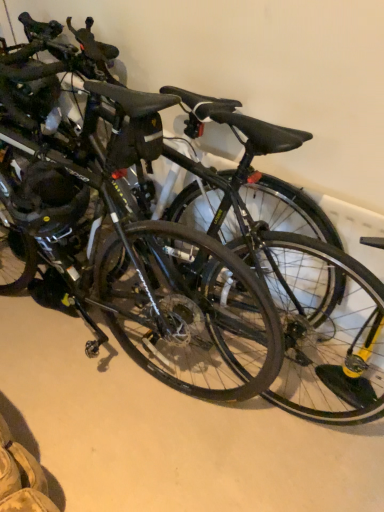
Question: Can you confirm if glossy black bicycle at center is taller than black matte bicycle at center?

Choices:
 (A) yes
 (B) no

Answer: (A)

Question: Does glossy black bicycle at center appear on the left side of black matte bicycle at center?

Choices:
 (A) yes
 (B) no

Answer: (B)

Question: Is glossy black bicycle at center further to camera compared to black matte bicycle at center?

Choices:
 (A) no
 (B) yes

Answer: (A)

Question: Is glossy black bicycle at center bigger than black matte bicycle at center?

Choices:
 (A) yes
 (B) no

Answer: (A)

Question: Considering the relative sizes of glossy black bicycle at center and black matte bicycle at center in the image provided, is glossy black bicycle at center shorter than black matte bicycle at center?

Choices:
 (A) yes
 (B) no

Answer: (B)

Question: Considering the positions of black matte bicycle at center and matte black helmet at left, which ranks as the first bicycle wheel in left-to-right order, in the image, is black matte bicycle at center taller or shorter than matte black helmet at left, which ranks as the first bicycle wheel in left-to-right order,?

Choices:
 (A) tall
 (B) short

Answer: (B)

Question: In the image, is black matte bicycle at center on the left side or the right side of matte black helmet at left, which ranks as the first bicycle wheel in left-to-right order?

Choices:
 (A) left
 (B) right

Answer: (B)

Question: Considering the positions of point (244, 465) and point (56, 185), is point (244, 465) closer or farther from the camera than point (56, 185)?

Choices:
 (A) farther
 (B) closer

Answer: (A)

Question: From the image's perspective, is black matte bicycle at center positioned above or below matte black helmet at left, which ranks as the first bicycle wheel in left-to-right order?

Choices:
 (A) below
 (B) above

Answer: (A)

Question: From a real-world perspective, is matte black helmet at left, acting as the second bicycle wheel starting from the right, positioned above or below glossy black bicycle at center?

Choices:
 (A) below
 (B) above

Answer: (B)

Question: From the image's perspective, relative to glossy black bicycle at center, is matte black helmet at left, which ranks as the first bicycle wheel in left-to-right order, above or below?

Choices:
 (A) above
 (B) below

Answer: (B)

Question: In the image, is matte black helmet at left, acting as the second bicycle wheel starting from the right, positioned in front of or behind glossy black bicycle at center?

Choices:
 (A) front
 (B) behind

Answer: (B)

Question: Is point (64, 168) closer or farther from the camera than point (134, 195)?

Choices:
 (A) farther
 (B) closer

Answer: (B)

Question: Looking at their shapes, would you say glossy black bicycle at center is wider or thinner than matte black helmet at left, which ranks as the first bicycle wheel in left-to-right order?

Choices:
 (A) wide
 (B) thin

Answer: (A)

Question: Considering the positions of glossy black bicycle at center and matte black helmet at left, acting as the second bicycle wheel starting from the right, in the image, is glossy black bicycle at center bigger or smaller than matte black helmet at left, acting as the second bicycle wheel starting from the right,?

Choices:
 (A) small
 (B) big

Answer: (B)